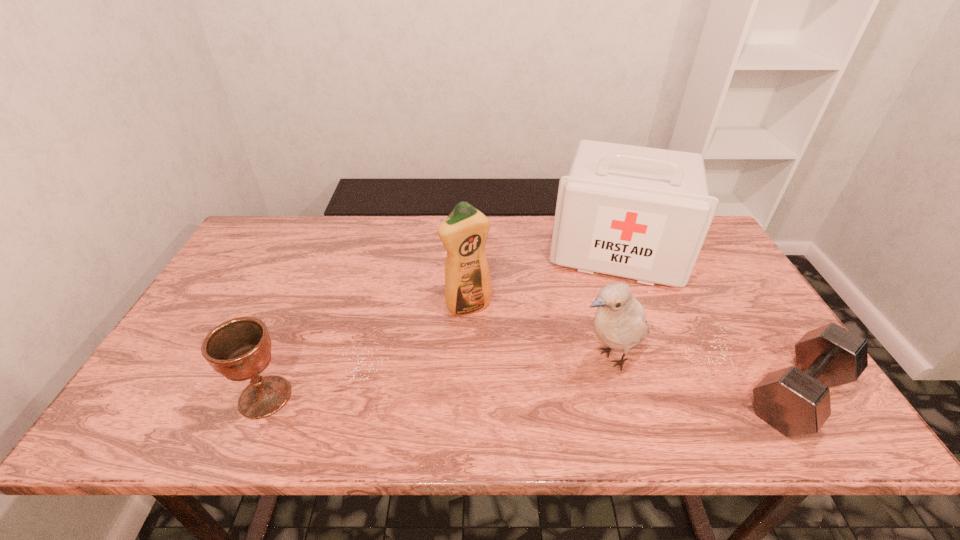
Locate an element on the screen. The height and width of the screenshot is (540, 960). dumbbell at the near edge is located at coordinates (795, 401).

Find the location of `bird that is at the near edge`. bird that is at the near edge is located at coordinates (620, 323).

Image resolution: width=960 pixels, height=540 pixels. Find the location of `dumbbell that is at the right edge`. dumbbell that is at the right edge is located at coordinates (795, 401).

This screenshot has width=960, height=540. In order to click on the first-aid kit situated at the right edge in this screenshot , I will do `click(642, 213)`.

You are a GUI agent. You are given a task and a screenshot of the screen. Output one action in this format:
    pyautogui.click(x=<x>, y=<y>)
    Task: Click on the object located in the far right corner section of the desktop
    The height and width of the screenshot is (540, 960).
    Given the screenshot: What is the action you would take?
    pyautogui.click(x=642, y=213)

What are the coordinates of `object present at the near right corner` in the screenshot? It's located at (795, 401).

You are a GUI agent. You are given a task and a screenshot of the screen. Output one action in this format:
    pyautogui.click(x=<x>, y=<y>)
    Task: Click on the vacant area at the far edge
    The height and width of the screenshot is (540, 960).
    Given the screenshot: What is the action you would take?
    pyautogui.click(x=533, y=220)

Where is `free region at the near edge of the desktop`? Image resolution: width=960 pixels, height=540 pixels. free region at the near edge of the desktop is located at coordinates (389, 374).

Where is `blank space at the left edge of the desktop`? blank space at the left edge of the desktop is located at coordinates (201, 333).

The height and width of the screenshot is (540, 960). In order to click on vacant area at the right edge in this screenshot , I will do `click(719, 327)`.